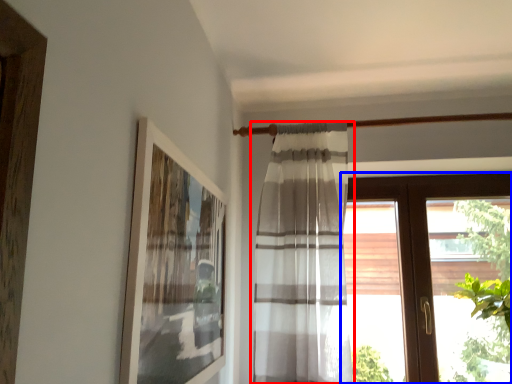
Question: Which object appears farthest to the camera in this image, curtain (highlighted by a red box) or window (highlighted by a blue box)?

Choices:
 (A) curtain
 (B) window

Answer: (B)